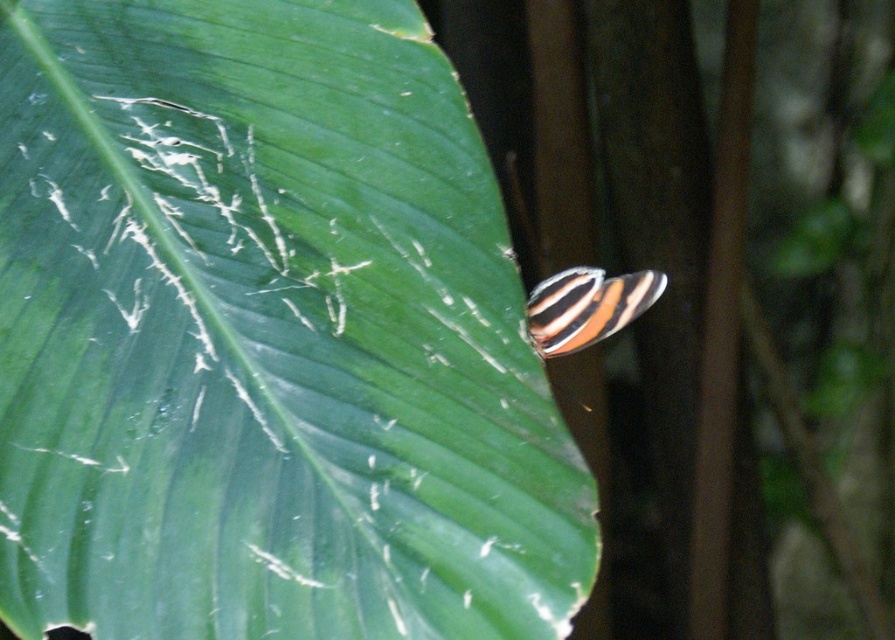
Between green matte leaf at upper left and striped winged insect at center, which one has more height?

green matte leaf at upper left

Is green matte leaf at upper left thinner than striped winged insect at center?

No.

The height and width of the screenshot is (640, 895). What do you see at coordinates (266, 337) in the screenshot?
I see `green matte leaf at upper left` at bounding box center [266, 337].

The image size is (895, 640). I want to click on green matte leaf at upper left, so click(266, 337).